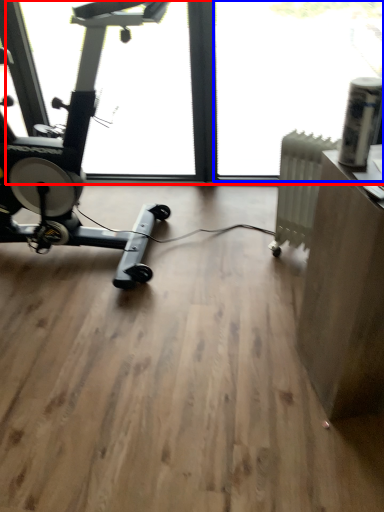
Question: Which point is further to the camera, window screen (highlighted by a red box) or window screen (highlighted by a blue box)?

Choices:
 (A) window screen
 (B) window screen

Answer: (B)